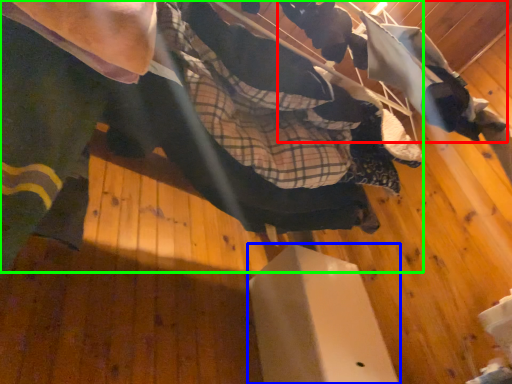
Question: Estimate the real-world distances between objects in this image. Which object is farther from squat (highlighted by a red box), furniture (highlighted by a blue box) or skateboarder (highlighted by a green box)?

Choices:
 (A) furniture
 (B) skateboarder

Answer: (A)